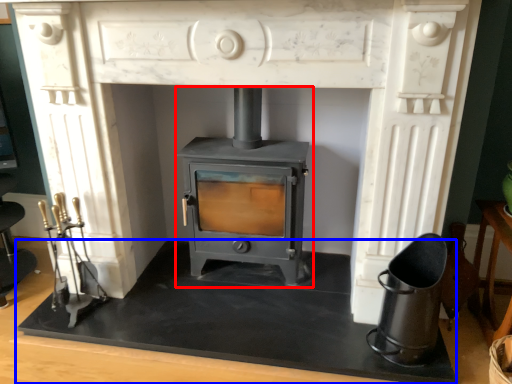
Question: Which object is further to the camera taking this photo, wood burning stove (highlighted by a red box) or slate (highlighted by a blue box)?

Choices:
 (A) wood burning stove
 (B) slate

Answer: (A)